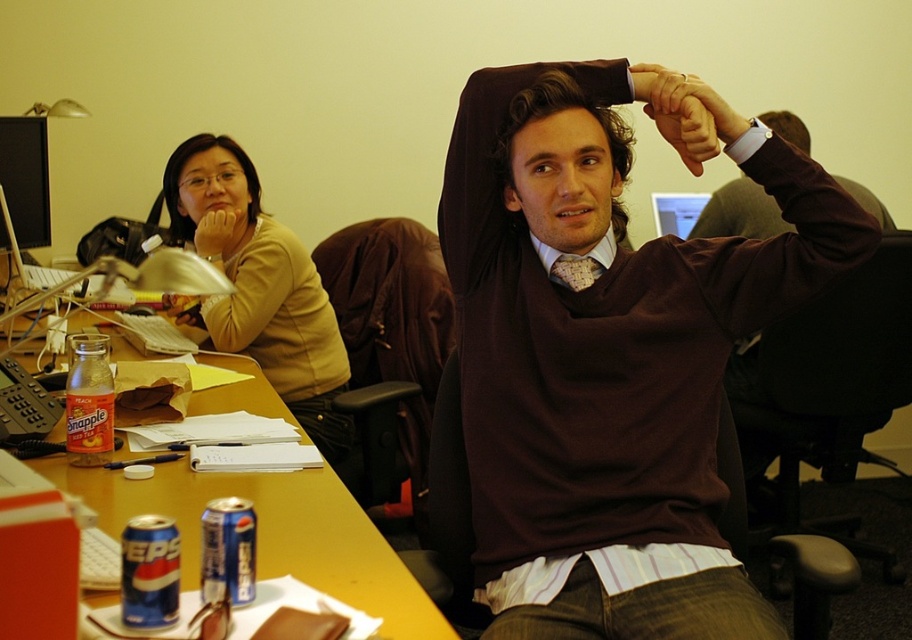
You are organizing a charity event and need to decide which item to donate first between the matte yellow sweater at left and the matte black hand at upper center. Based on their sizes, which one should you choose?

The matte yellow sweater at left is bigger than the matte black hand at upper center, so you should donate the matte yellow sweater at left first.

You are standing in an office and want to place a 12 inch wide laptop on the yellow wood desk at center. Can the laptop fit on the desk?

The yellow wood desk at center is 37.05 inches from viewer. The distance from the viewer to the desk does not indicate the desk size, so we cannot determine if the laptop will fit based on the provided information.

You are an office assistant who needs to identify which object is shorter between the matte black hand at upper center and the matte yellow shirt at upper left. Can you determine which one is shorter?

The matte black hand at upper center is not as tall as the matte yellow shirt at upper left, so the matte black hand at upper center is shorter.